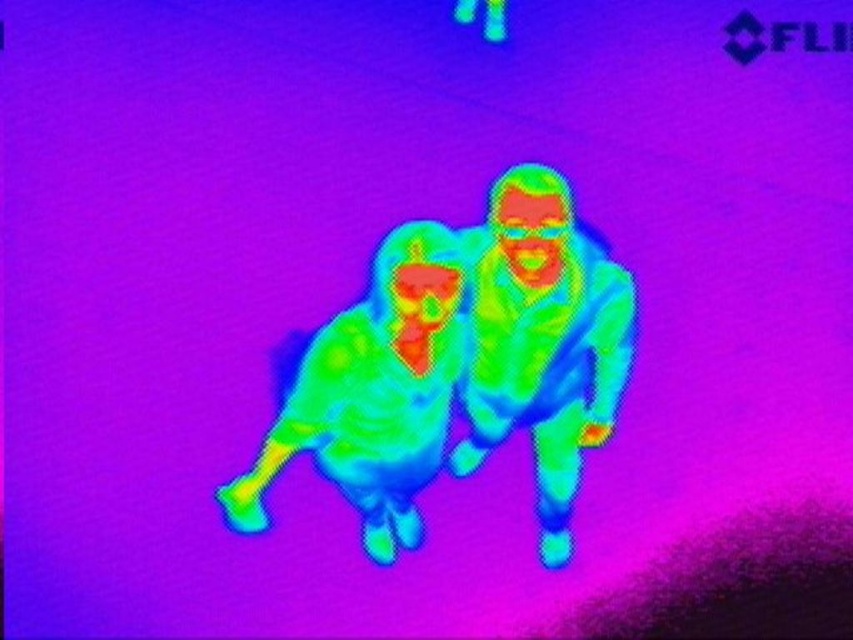
You are analyzing a thermal scan image where two figures are present. You notice two specific points labeled as point 1 and point 2. Point 1 is at coordinates point (556, 416) and point 2 is at point (345, 468). Based on the thermal scan, which point is further away from the camera?

Point (556, 416) is behind point (345, 468), so it is further away from the camera.

You are analyzing a thermal scan image where two figures are present. One is lying down on the left, and the other is sitting upright on the right. A point labeled as point (543, 340) is marked in the image. Which figure does this point belong to?

The point (543, 340) marks the green matte figure at center, so it belongs to the green matte figure at center.